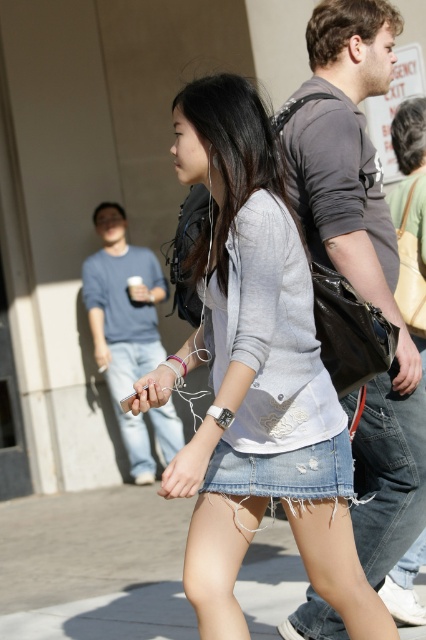
Image resolution: width=426 pixels, height=640 pixels. Describe the element at coordinates (362, 259) in the screenshot. I see `dark gray fabric backpack at center` at that location.

Who is taller, dark gray fabric backpack at center or denim skirt at lower center?

With more height is dark gray fabric backpack at center.

Is point (388, 28) farther from viewer compared to point (37, 605)?

No, it is not.

The height and width of the screenshot is (640, 426). I want to click on dark gray fabric backpack at center, so tap(362, 259).

Is denim skirt at center closer to camera compared to dark gray fabric backpack at center?

Answer: Yes, it is in front of dark gray fabric backpack at center.

Does point (336, 550) lie in front of point (324, 614)?

Yes, it is.

The image size is (426, 640). I want to click on denim skirt at center, so click(256, 376).

Based on the photo, does denim skirt at center appear over denim skirt at lower center?

Correct, denim skirt at center is located above denim skirt at lower center.

Consider the image. Between denim skirt at center and denim skirt at lower center, which one is positioned lower?

denim skirt at lower center

Between point (236, 252) and point (184, 616), which one is positioned behind?

Point (184, 616)

At what (x,y) coordinates should I click in order to perform the action: click on denim skirt at center. Please return your answer as a coordinate pair (x, y). Looking at the image, I should click on (256, 376).